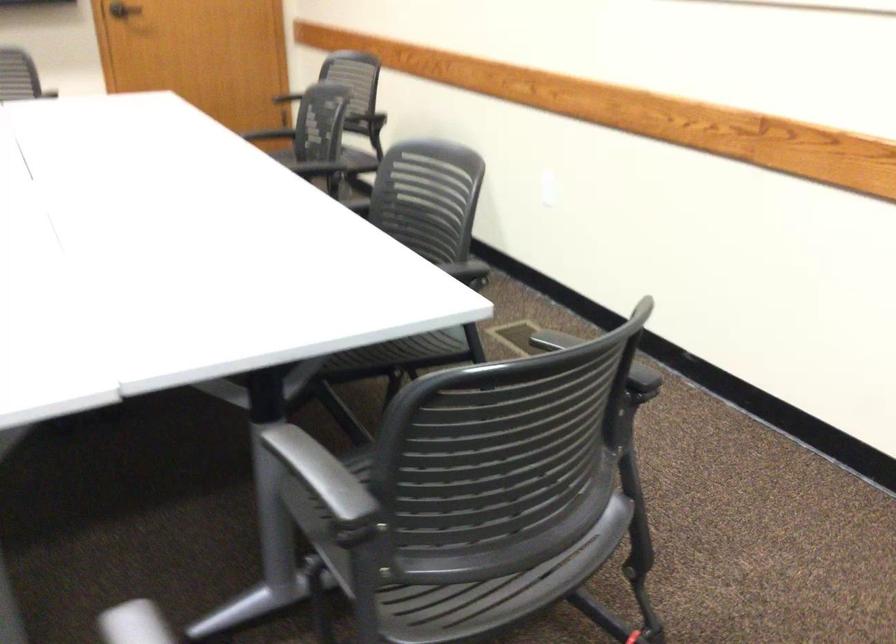
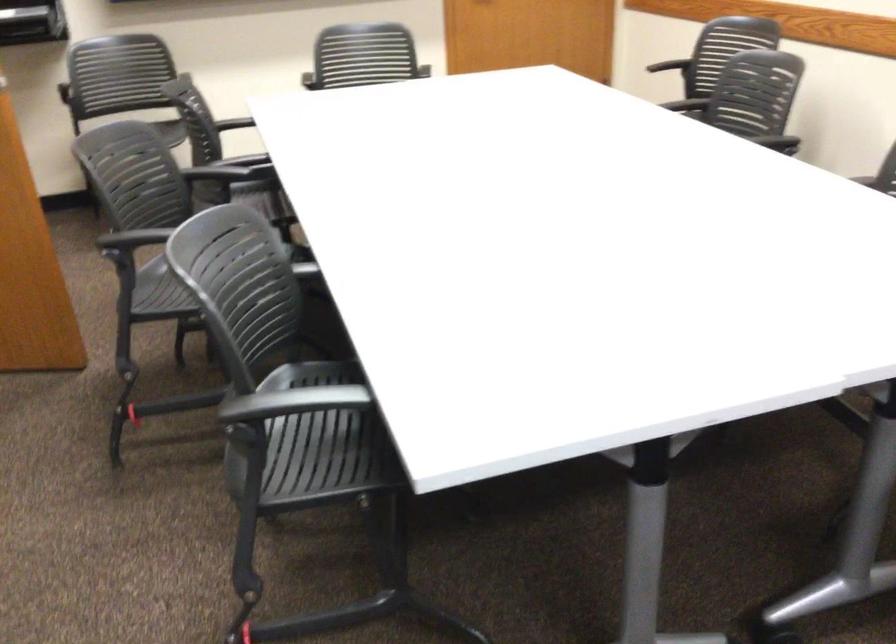
Question: Based on the continuous images, in which direction is the camera rotating? Reply with the corresponding letter.

Choices:
 (A) Left
 (B) Right
 (C) Up
 (D) Down

Answer: (A)